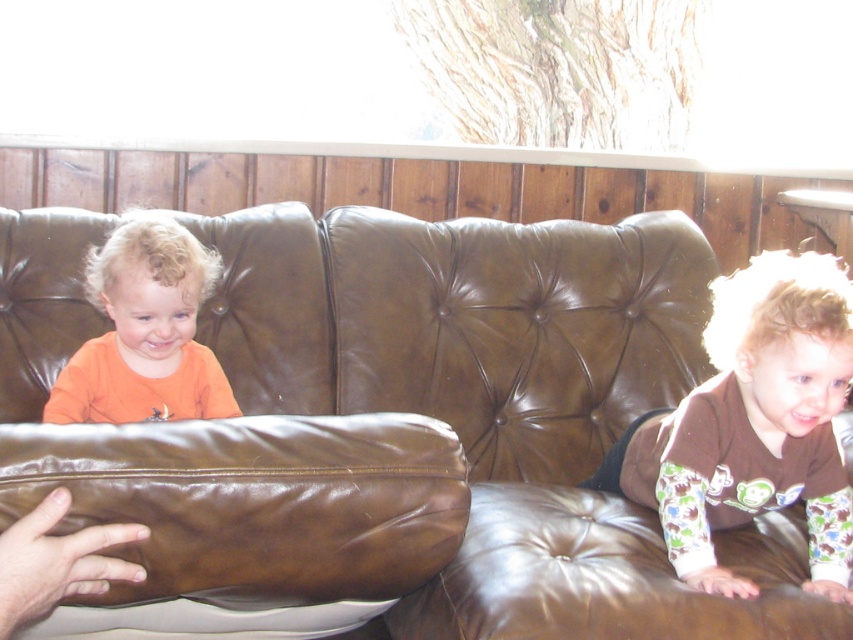
You are a photographer setting up a camera at point coordinates. You want to capture the brown leather couch at center in your shot. What coordinates should you aim for?

The brown leather couch at center is located at coordinates point (x=399, y=424). So you should aim your camera at point coordinates (x=399, y=424) to capture the brown leather couch at center.

You are a photographer setting up a shoot in this living room scene. You need to ensure that both the brown cotton onesie at right and the orange matte shirt at left are clearly visible in the photo. Based on their positions, which clothing item will appear larger in the photo?

The brown cotton onesie at right appears closer to the viewer than the orange matte shirt at left, so it will look larger in the photo.

You are a photographer setting up for a family portrait. You notice the brown cotton onesie at right and the brown leather hand at lower left in the scene. Which object would you need to adjust your camera focus for if you want to capture both in sharp detail, considering their sizes?

The brown cotton onesie at right is larger in size than the brown leather hand at lower left, so you should focus on the larger object to ensure both are in sharp detail.